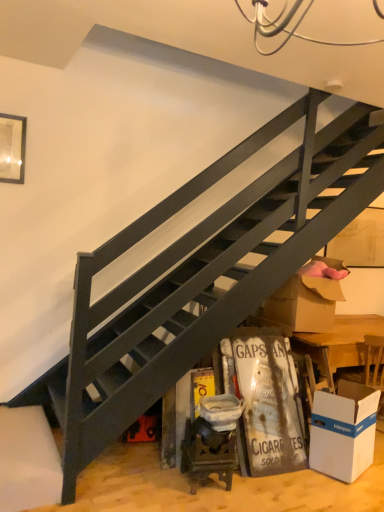
Locate an element on the screen. empty space that is ontop of white cardboard box at lower right (from a real-world perspective) is located at coordinates (356, 387).